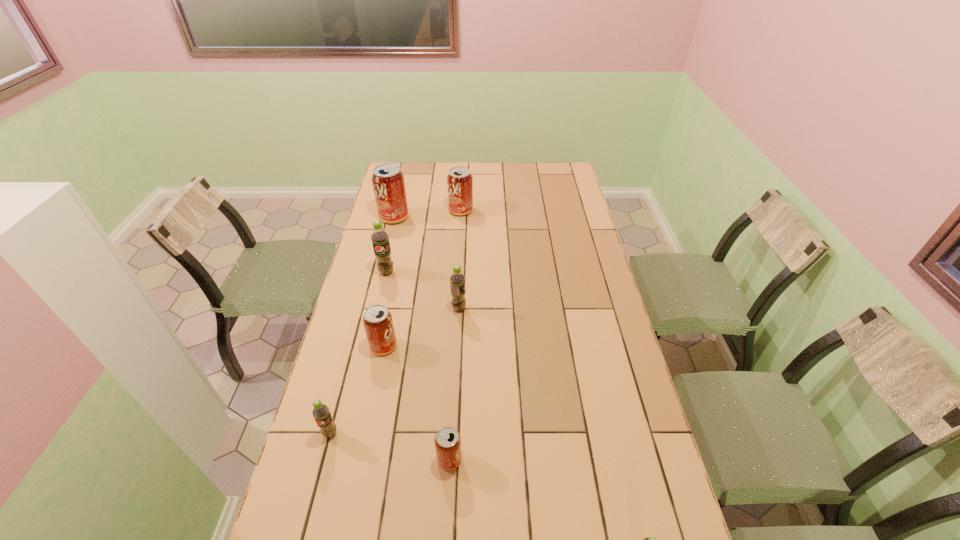
Locate an element on the screen. The image size is (960, 540). the biggest red soda can is located at coordinates point(388,182).

Identify the location of the farthest green soda. The image size is (960, 540). (380, 238).

Identify the location of the biggest green soda. (380, 238).

Locate an element on the screen. the third smallest red soda can is located at coordinates (459, 180).

This screenshot has height=540, width=960. Find the location of `the second biggest green soda`. the second biggest green soda is located at coordinates (457, 279).

At what (x,y) coordinates should I click in order to perform the action: click on the fourth farthest soda. Please return your answer as a coordinate pair (x, y). The image size is (960, 540). Looking at the image, I should click on (457, 279).

This screenshot has height=540, width=960. Identify the location of the third farthest red soda can. (377, 320).

Locate an element on the screen. the fourth nearest soda is located at coordinates (377, 320).

This screenshot has width=960, height=540. What are the coordinates of `the second smallest green soda` in the screenshot? It's located at tap(321, 414).

Identify the location of the second nearest green soda. Image resolution: width=960 pixels, height=540 pixels. (321, 414).